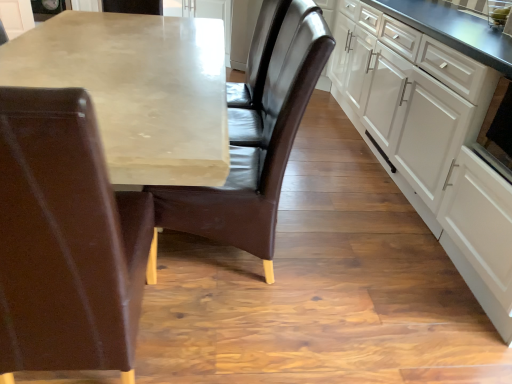
Identify the location of free space above matte concrete table at center (from a real-world perspective). The image size is (512, 384). (115, 61).